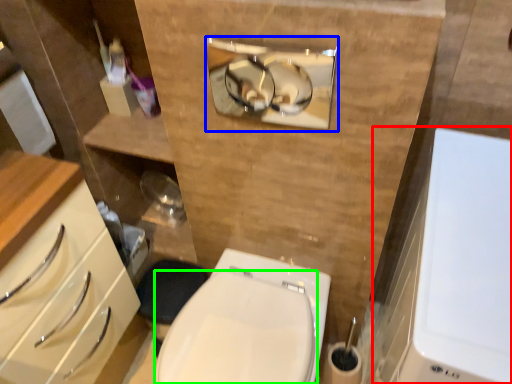
Question: Which object is the farthest from medicine cabinet (highlighted by a red box)? Choose among these: medicine cabinet (highlighted by a blue box) or bidet (highlighted by a green box).

Choices:
 (A) medicine cabinet
 (B) bidet

Answer: (A)